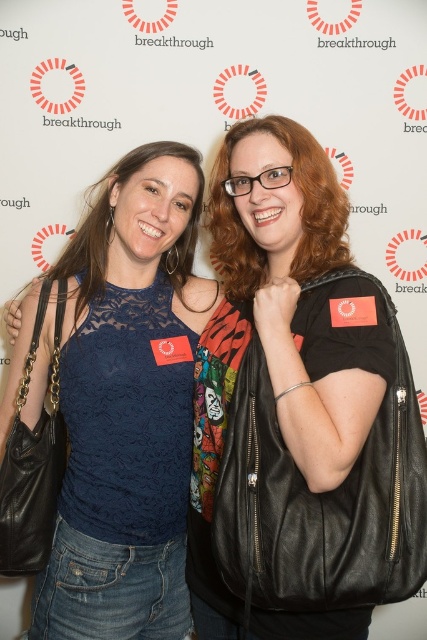
Question: Which point is closer to the camera?

Choices:
 (A) (79, 550)
 (B) (222, 595)

Answer: (B)

Question: Is lace fabric top at center further to the viewer compared to black leather jacket at center?

Choices:
 (A) no
 (B) yes

Answer: (B)

Question: Does lace fabric top at center have a greater width compared to black leather jacket at center?

Choices:
 (A) yes
 (B) no

Answer: (A)

Question: Does lace fabric top at center appear on the left side of black leather jacket at center?

Choices:
 (A) no
 (B) yes

Answer: (B)